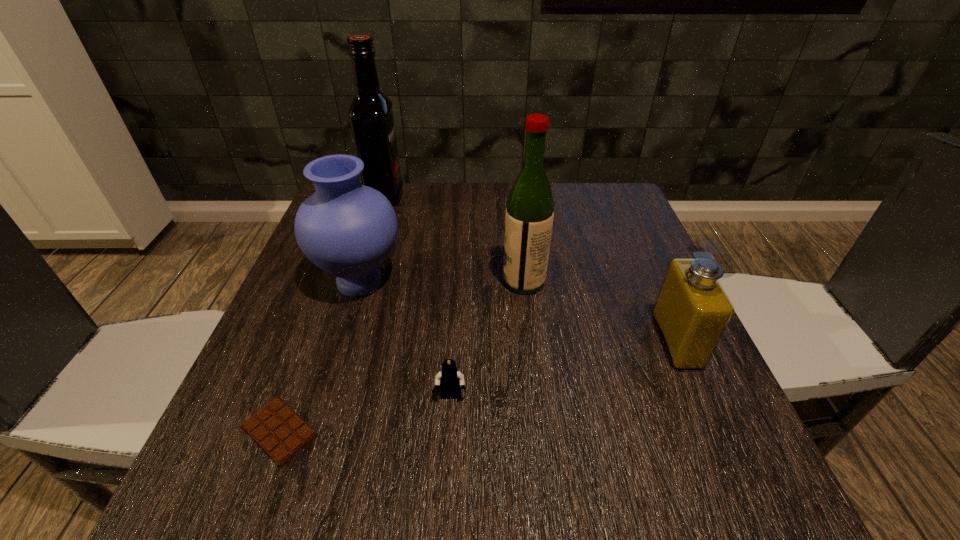
This screenshot has width=960, height=540. I want to click on free space located on the front-facing side of the farther liquor, so click(428, 197).

Find the location of a particular element. This screenshot has width=960, height=540. vacant region located 0.280m on the label of the fifth object from left to right is located at coordinates (371, 282).

You are a GUI agent. You are given a task and a screenshot of the screen. Output one action in this format:
    pyautogui.click(x=<x>, y=<y>)
    Task: Click on the blank area located on the label of the fifth object from left to right
    The image size is (960, 540).
    Given the screenshot: What is the action you would take?
    pyautogui.click(x=461, y=282)

Find the location of a particular element. The width and height of the screenshot is (960, 540). vacant space located on the label of the fifth object from left to right is located at coordinates (319, 282).

At what (x,y) coordinates should I click in order to perform the action: click on free space located 0.090m on the back of the vase. Please return your answer as a coordinate pair (x, y). The width and height of the screenshot is (960, 540). Looking at the image, I should click on (375, 232).

The height and width of the screenshot is (540, 960). I want to click on free space located 0.090m on the front-facing side of the perfume, so click(612, 341).

At what (x,y) coordinates should I click in order to perform the action: click on blank area located on the front-facing side of the perfume. Please return your answer as a coordinate pair (x, y). Image resolution: width=960 pixels, height=540 pixels. Looking at the image, I should click on (546, 341).

Image resolution: width=960 pixels, height=540 pixels. In order to click on free point located on the front-facing side of the perfume in this screenshot , I will do `click(557, 341)`.

In order to click on vacant space situated on the front-facing side of the fifth tallest object in this screenshot , I will do click(x=445, y=494).

Find the location of `vacant point located on the back of the shortest object`. vacant point located on the back of the shortest object is located at coordinates (342, 267).